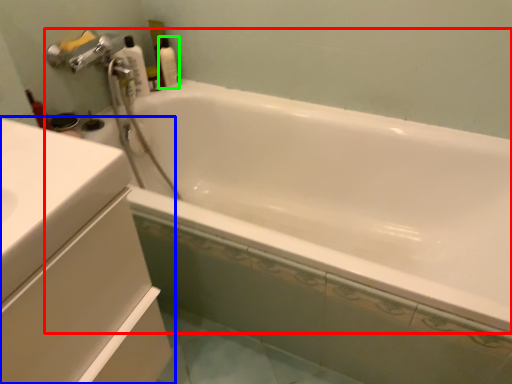
Question: Which object is the closest to the bathtub (highlighted by a red box)? Choose among these: bathroom cabinet (highlighted by a blue box) or cleaning product (highlighted by a green box).

Choices:
 (A) bathroom cabinet
 (B) cleaning product

Answer: (B)